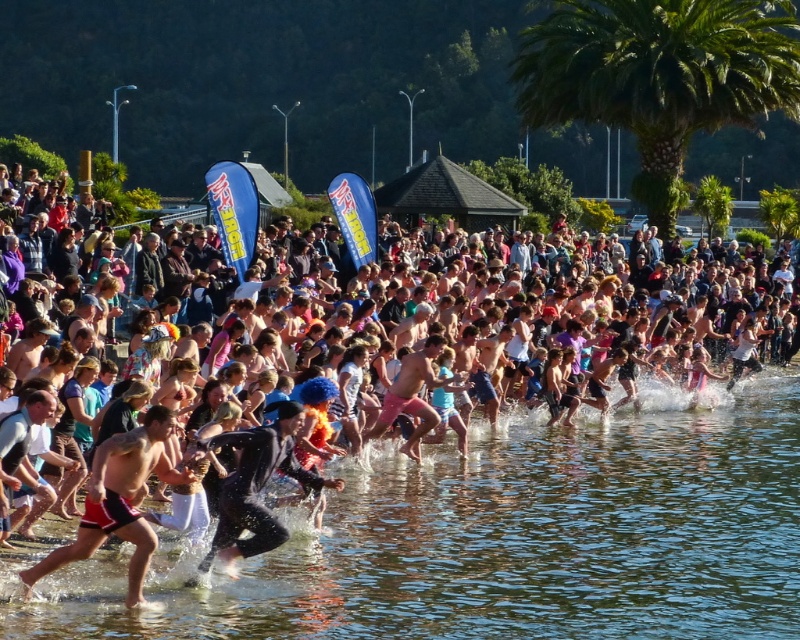
Is pink fabric crowd at center wider than red shorts at center?

Correct, the width of pink fabric crowd at center exceeds that of red shorts at center.

Between point (318, 435) and point (128, 584), which one is positioned in front?

Positioned in front is point (128, 584).

Is point (496, 259) closer to viewer compared to point (84, 534)?

No, (496, 259) is further to viewer.

Identify the location of pink fabric crowd at center. The width and height of the screenshot is (800, 640). (580, 323).

Is point (740, 636) closer to viewer compared to point (472, 365)?

That is True.

Who is shorter, clear water at center or pink fabric crowd at center?

clear water at center is shorter.

Locate an element on the screen. clear water at center is located at coordinates (508, 538).

Locate an element on the screen. clear water at center is located at coordinates pyautogui.click(x=508, y=538).

Which is behind, point (754, 115) or point (85, 554)?

Point (754, 115)

In the scene shown: Does green leafy palm tree at upper right have a lesser height compared to red shorts at center?

In fact, green leafy palm tree at upper right may be taller than red shorts at center.

Is point (712, 28) positioned before point (146, 529)?

No, (712, 28) is behind (146, 529).

This screenshot has width=800, height=640. I want to click on green leafy palm tree at upper right, so click(660, 76).